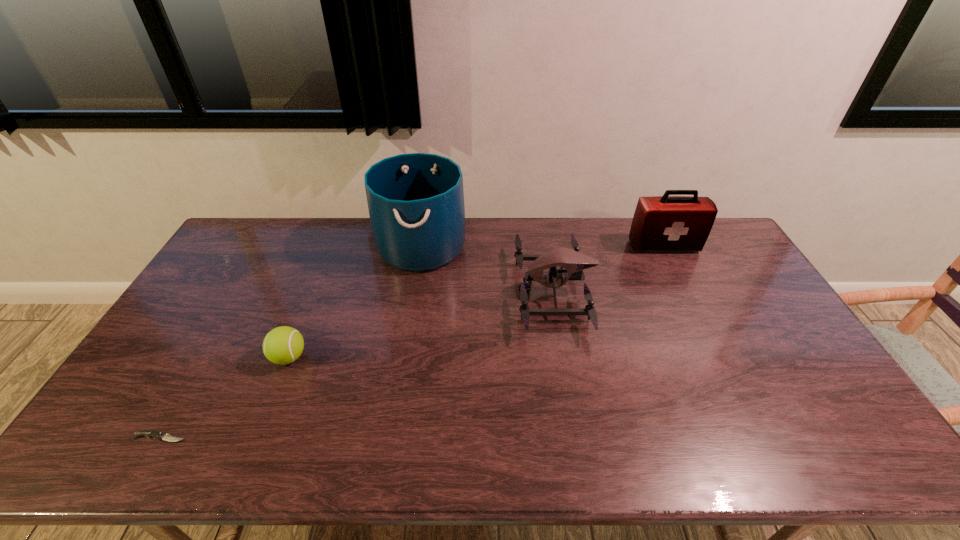
Find the location of a particular element. bucket is located at coordinates (416, 201).

Locate an element on the screen. the third object from right to left is located at coordinates (416, 201).

The image size is (960, 540). What are the coordinates of `the first aid kit` in the screenshot? It's located at [x=665, y=223].

This screenshot has height=540, width=960. Identify the location of the rightmost object. (665, 223).

The width and height of the screenshot is (960, 540). I want to click on the fourth object from left to right, so click(573, 262).

Where is `the third tallest object`? the third tallest object is located at coordinates (573, 262).

In order to click on the second object from left to right in this screenshot , I will do `click(283, 345)`.

Locate an element on the screen. The width and height of the screenshot is (960, 540). the fourth tallest object is located at coordinates (283, 345).

Where is `pocketknife`? pocketknife is located at coordinates (149, 433).

What are the coordinates of `the leftmost object` in the screenshot? It's located at (149, 433).